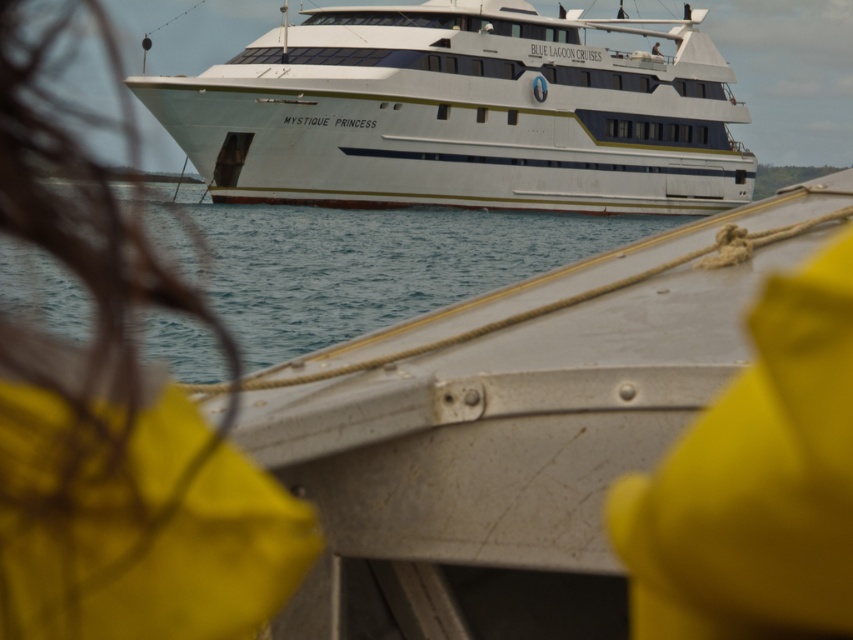
In the scene shown: You are standing on the deck of the Mystique Princess cruise ship and notice a yellow fabric at center. If you want to locate it precisely, what are its coordinates?

The yellow fabric at center is located at coordinates point (115, 422).